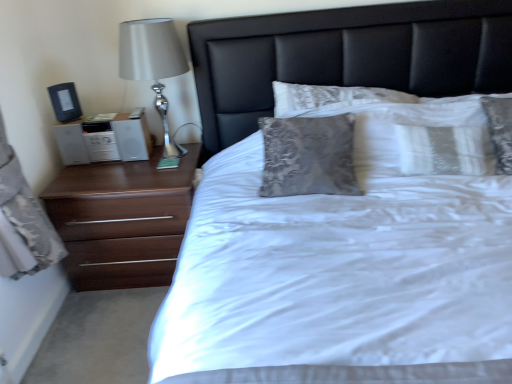
This screenshot has height=384, width=512. What are the coordinates of `free point above white glossy nightstand at left (from a real-world perspective)` in the screenshot? It's located at (101, 120).